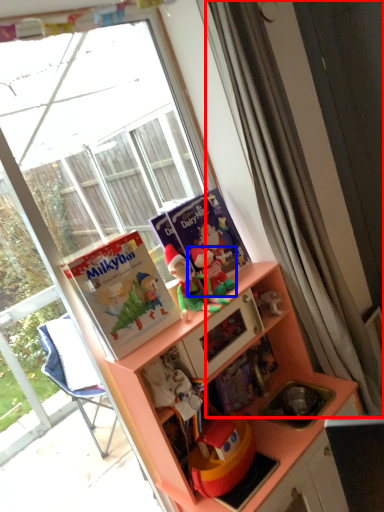
Question: Which of the following is the closest to the observer, curtain (highlighted by a red box) or toy (highlighted by a blue box)?

Choices:
 (A) curtain
 (B) toy

Answer: (A)